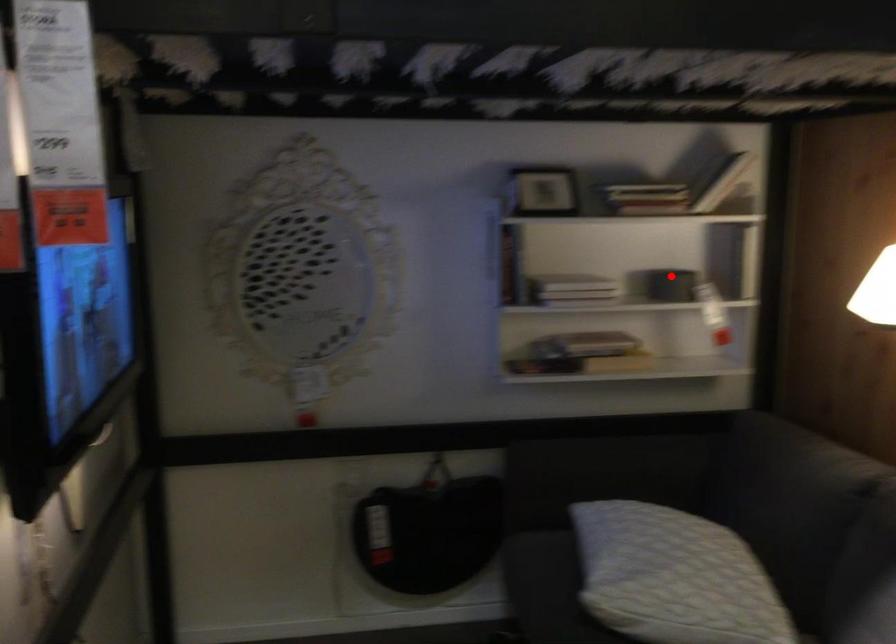
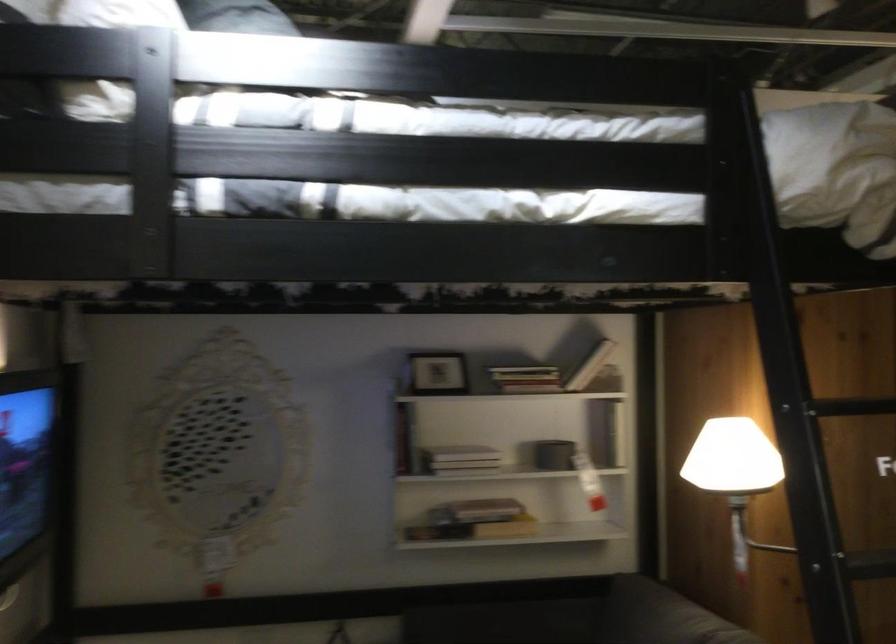
Where in the second image is the point corresponding to the highlighted location from the first image?

(553, 453)